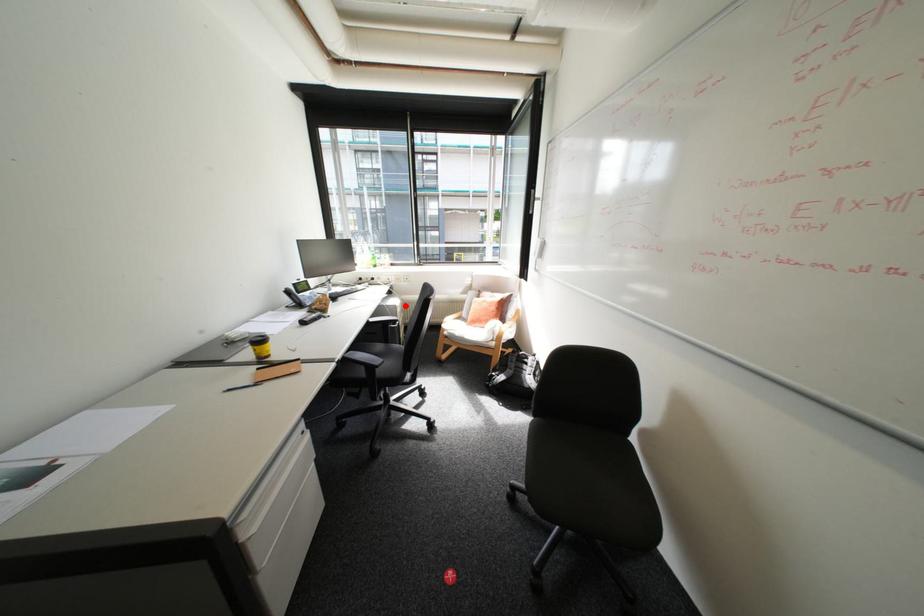
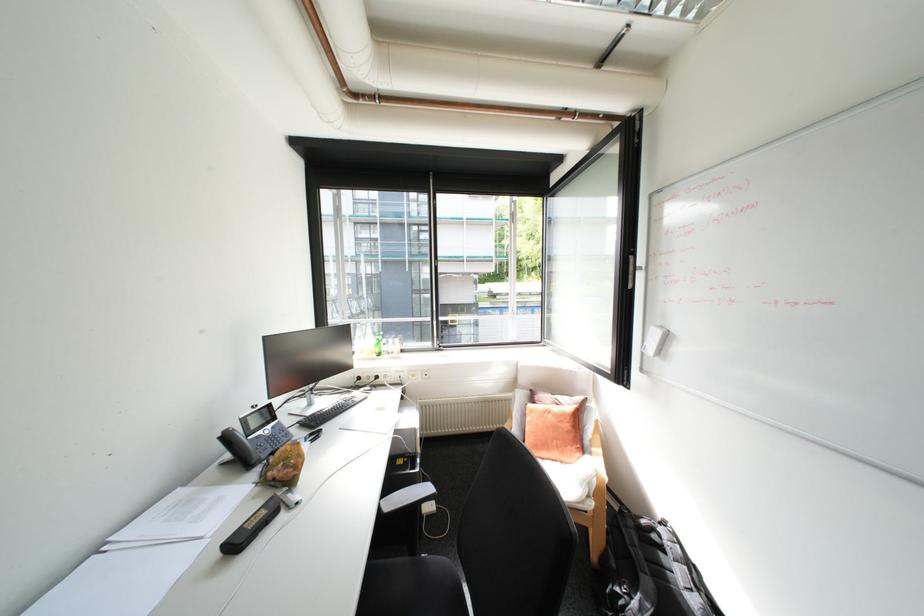
Question: I am providing you with two images of the same scene from different viewpoints. Given a red point in image1, look at the same physical point in image2. Is it:

Choices:
 (A) Closer to the viewpoint
 (B) Farther from the viewpoint

Answer: (A)